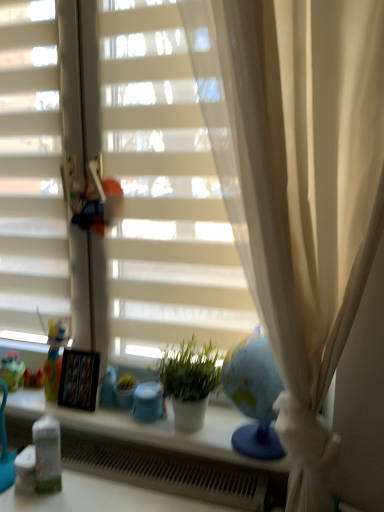
This screenshot has height=512, width=384. Find the location of `matte plastic doll at left`. matte plastic doll at left is located at coordinates pyautogui.click(x=55, y=355).

What do you see at coordinates (12, 371) in the screenshot?
I see `matte green toy at left` at bounding box center [12, 371].

This screenshot has width=384, height=512. Find the location of `matte green toy at left`. matte green toy at left is located at coordinates (12, 371).

Locate an element on the screen. The width and height of the screenshot is (384, 512). blue glossy vase at center is located at coordinates (125, 397).

This screenshot has height=512, width=384. Describe the element at coordinates (125, 397) in the screenshot. I see `blue glossy vase at center` at that location.

Find the location of a particular element. Image resolution: width=384 pixels, height=512 pixels. white matte blinds at center is located at coordinates (163, 193).

The width and height of the screenshot is (384, 512). Find the location of `white matte shutter at left`. white matte shutter at left is located at coordinates 31,174.

Locate an element on the screen. metallic silver picture frame at center is located at coordinates (79, 379).

Considering the sizes of objects white matte shutter at left and matte green toy at left in the image provided, who is taller, white matte shutter at left or matte green toy at left?

white matte shutter at left is taller.

Is white matte shutter at left facing away from matte green toy at left?

That's not correct — white matte shutter at left is not looking away from matte green toy at left.

Based on the photo, is white matte shutter at left wider than matte green toy at left?

In fact, white matte shutter at left might be narrower than matte green toy at left.

From the image's perspective, who appears lower, white matte shutter at left or matte green toy at left?

From the image's view, matte green toy at left is below.

Does matte green toy at left have a smaller size compared to blue glossy vase at center?

No.

Can you see matte green toy at left touching blue glossy vase at center?

matte green toy at left and blue glossy vase at center are not in contact.

From a real-world perspective, between matte green toy at left and blue glossy vase at center, who is vertically lower?

From a 3D spatial view, blue glossy vase at center is below.

Find the location of `glass vase lying in front of the matte green toy at left`. glass vase lying in front of the matte green toy at left is located at coordinates (125, 397).

Can you tell me how much matte plastic doll at left and white plastic radiator at lower center differ in facing direction?

They differ by 0.00585 degrees in their facing directions.

From the image's perspective, is matte plastic doll at left located above white plastic radiator at lower center?

Yes, from the image's perspective, matte plastic doll at left is above white plastic radiator at lower center.

From a real-world perspective, does matte plastic doll at left stand above white plastic radiator at lower center?

Yes, from a real-world perspective, matte plastic doll at left is above white plastic radiator at lower center.

Considering the relative sizes of matte plastic doll at left and white plastic radiator at lower center in the image provided, is matte plastic doll at left taller than white plastic radiator at lower center?

Indeed, matte plastic doll at left has a greater height compared to white plastic radiator at lower center.

Considering the positions of points (71, 438) and (13, 352), is point (71, 438) farther from camera compared to point (13, 352)?

No, (71, 438) is closer to viewer.

From a real-world perspective, which is physically below, white plastic radiator at lower center or matte green toy at left?

In real-world perspective, white plastic radiator at lower center is lower.

Could you tell me if white plastic radiator at lower center is turned towards matte green toy at left?

No.

Do you think white plastic radiator at lower center is within matte green toy at left, or outside of it?

white plastic radiator at lower center is not enclosed by matte green toy at left.

Does matte plastic doll at left contain matte green toy at left?

No, matte green toy at left is located outside of matte plastic doll at left.

Can you tell me how much matte plastic doll at left and matte green toy at left differ in facing direction?

The angular difference between matte plastic doll at left and matte green toy at left is 0.00154 degrees.

Between point (52, 347) and point (17, 380), which one is positioned in front?

Positioned in front is point (17, 380).

The image size is (384, 512). Identify the location of doll that is above the matte green toy at left (from the image's perspective). click(55, 355).

Based on the photo, is white matte plant pot at center not near metallic silver picture frame at center?

No, white matte plant pot at center is in close proximity to metallic silver picture frame at center.

From the picture: In the image, is white matte plant pot at center positioned in front of or behind metallic silver picture frame at center?

white matte plant pot at center is positioned closer to the viewer than metallic silver picture frame at center.

From the image's perspective, is white matte plant pot at center located beneath metallic silver picture frame at center?

No.

Considering the positions of point (160, 78) and point (184, 351), is point (160, 78) closer or farther from the camera than point (184, 351)?

Point (160, 78) is positioned closer to the camera compared to point (184, 351).

Does white matte blinds at center have a greater height compared to white matte plant pot at center?

Yes, white matte blinds at center is taller than white matte plant pot at center.

From the image's perspective, which one is positioned lower, white matte blinds at center or white matte plant pot at center?

white matte plant pot at center.

I want to click on shutter above the matte green toy at left (from a real-world perspective), so click(x=31, y=174).

Where is `toy above the blue glossy vase at center (from the image's perspective)`? Image resolution: width=384 pixels, height=512 pixels. toy above the blue glossy vase at center (from the image's perspective) is located at coordinates (12, 371).

Based on their spatial positions, is matte green toy at left or white matte shutter at left further from metallic silver picture frame at center?

white matte shutter at left lies further to metallic silver picture frame at center than the other object.

Which object lies nearer to the anchor point white matte shutter at left, matte plastic doll at left or white matte plant pot at center?

matte plastic doll at left is closer to white matte shutter at left.

Based on the photo, which object lies further to the anchor point metallic silver picture frame at center, white matte blinds at center or matte green toy at left?

Based on the image, white matte blinds at center appears to be further to metallic silver picture frame at center.

Based on their spatial positions, is matte green toy at left or metallic silver picture frame at center further from blue glossy vase at center?

The object further to blue glossy vase at center is matte green toy at left.

Considering their positions, is matte green toy at left positioned closer to white matte shutter at left than white matte blinds at center?

The object closer to white matte shutter at left is white matte blinds at center.

Based on their spatial positions, is white matte shutter at left or matte green toy at left closer to white plastic radiator at lower center?

Based on the image, matte green toy at left appears to be nearer to white plastic radiator at lower center.

Considering their positions, is white matte shutter at left positioned further to matte plastic doll at left than metallic silver picture frame at center?

Among the two, white matte shutter at left is located further to matte plastic doll at left.

From the image, which object appears to be farther from blue glossy vase at center, white plastic radiator at lower center or matte plastic doll at left?

matte plastic doll at left is positioned further to the anchor blue glossy vase at center.

Locate an element on the screen. This screenshot has width=384, height=512. picture frame between matte plastic doll at left and blue glossy vase at center from left to right is located at coordinates (79, 379).

Where is `blind between white matte shutter at left and metallic silver picture frame at center in the vertical direction`? The image size is (384, 512). blind between white matte shutter at left and metallic silver picture frame at center in the vertical direction is located at coordinates (163, 193).

Find the location of `glass vase that lies between matte plastic doll at left and white plastic radiator at lower center from top to bottom`. glass vase that lies between matte plastic doll at left and white plastic radiator at lower center from top to bottom is located at coordinates (125, 397).

You are a GUI agent. You are given a task and a screenshot of the screen. Output one action in this format:
    pyautogui.click(x=<x>, y=<y>)
    Task: Click on the radiator located between metallic silver picture frame at center and white matte plant pot at center in the left-right direction
    This screenshot has height=512, width=384.
    Given the screenshot: What is the action you would take?
    pyautogui.click(x=165, y=470)